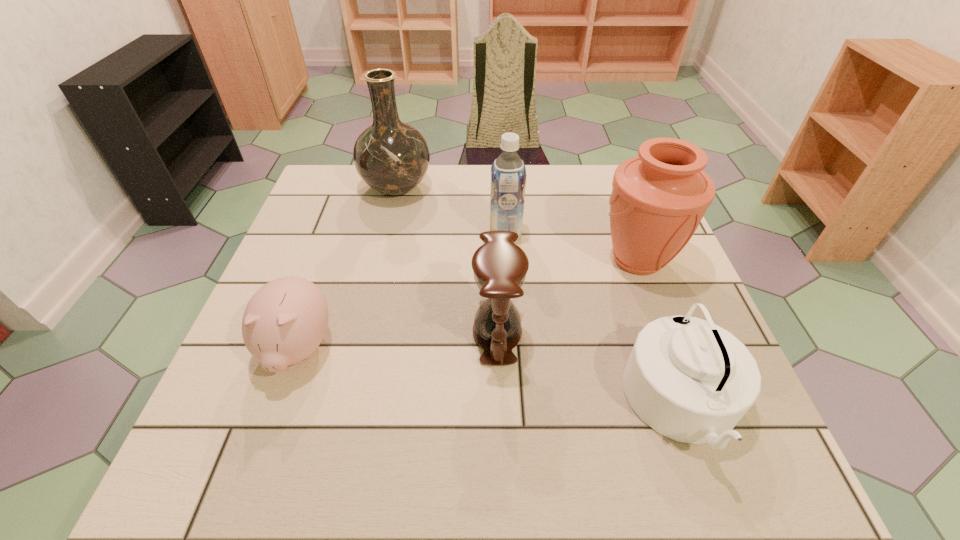
You are a GUI agent. You are given a task and a screenshot of the screen. Output one action in this format:
    pyautogui.click(x=<x>, y=<y>)
    Task: Click on the farther vase
    This screenshot has width=960, height=540.
    Given the screenshot: What is the action you would take?
    pyautogui.click(x=392, y=157)

The height and width of the screenshot is (540, 960). I want to click on the farthest object, so click(x=392, y=157).

At what (x,y) coordinates should I click in order to perform the action: click on the nearer vase. Please return your answer as a coordinate pair (x, y). The width and height of the screenshot is (960, 540). Looking at the image, I should click on (658, 199).

Find the location of a particular element. The image size is (960, 540). soya milk is located at coordinates (508, 172).

The width and height of the screenshot is (960, 540). Find the location of `hourglass`. hourglass is located at coordinates [x=500, y=266].

Locate an element on the screen. Image resolution: width=960 pixels, height=540 pixels. kettle is located at coordinates (690, 380).

You are a GUI agent. You are given a task and a screenshot of the screen. Output one action in this format:
    pyautogui.click(x=<x>, y=<y>)
    Task: Click on the piggy bank
    The image size is (960, 540).
    Given the screenshot: What is the action you would take?
    pyautogui.click(x=284, y=322)

This screenshot has height=540, width=960. Find the location of `vacant area situated on the front of the left vase`. vacant area situated on the front of the left vase is located at coordinates (383, 248).

Identify the location of vacant space situated 0.200m on the front of the right vase. The width and height of the screenshot is (960, 540). (677, 366).

Where is `vacant area located on the label of the soya milk`? The width and height of the screenshot is (960, 540). vacant area located on the label of the soya milk is located at coordinates (420, 233).